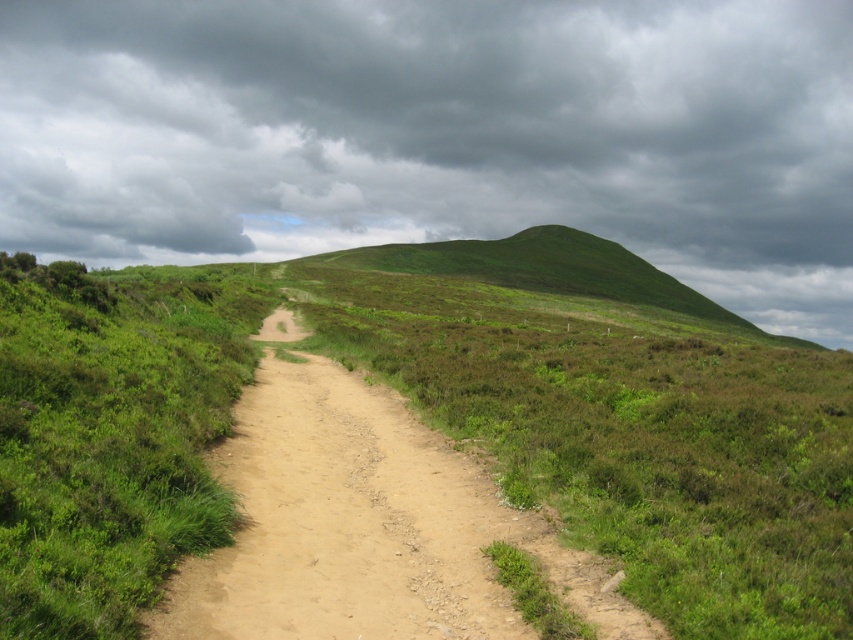
Question: Is green grassy hill at upper center above brown sandy dirt track at center?

Choices:
 (A) yes
 (B) no

Answer: (A)

Question: Is green grassy hill at upper center above brown sandy dirt track at center?

Choices:
 (A) yes
 (B) no

Answer: (A)

Question: Which of the following is the closest to the observer?

Choices:
 (A) green grassy hill at upper center
 (B) brown sandy dirt track at center

Answer: (B)

Question: In this image, where is green grassy hill at upper center located relative to brown sandy dirt track at center?

Choices:
 (A) left
 (B) right

Answer: (B)